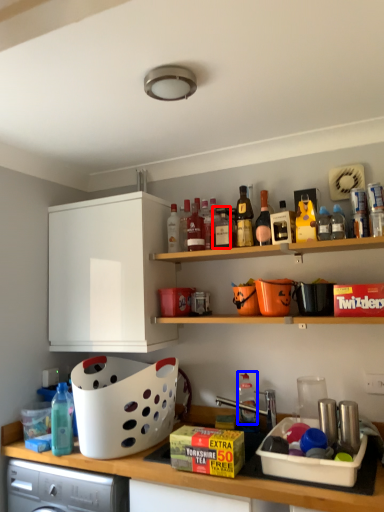
Question: Which of the following is the closest to the observer, bottle (highlighted by a red box) or bottle (highlighted by a blue box)?

Choices:
 (A) bottle
 (B) bottle

Answer: (A)